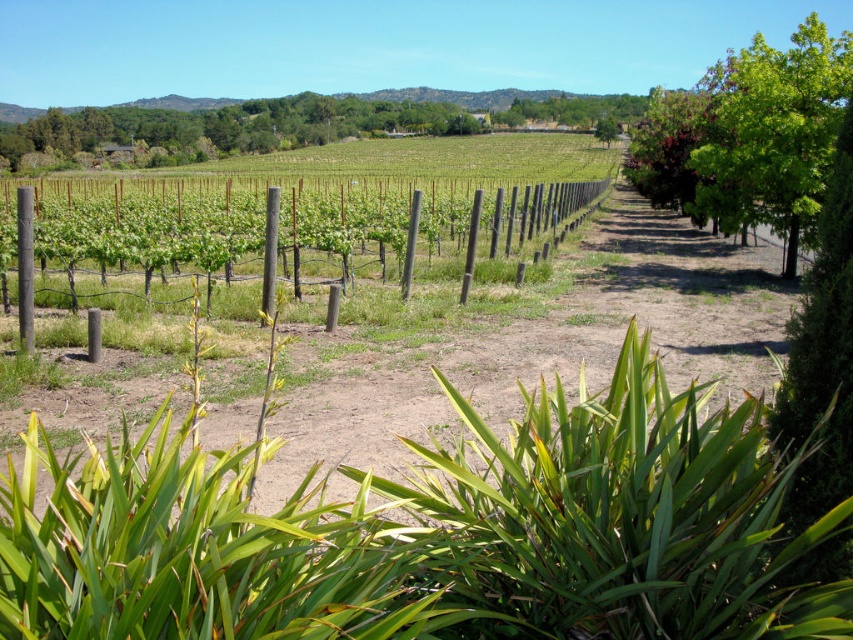
From the picture: Is green leafy tree at right shorter than green leafy tree at upper center?

No.

Can you confirm if green leafy tree at right is positioned above green leafy tree at upper center?

Actually, green leafy tree at right is below green leafy tree at upper center.

Locate an element on the screen. This screenshot has width=853, height=640. green leafy tree at right is located at coordinates (750, 134).

Is point (769, 45) positioned behind point (605, 138)?

No, (769, 45) is closer to viewer.

Between green leafy tree at right and green leafy tree at center-right, which one has less height?

With less height is green leafy tree at center-right.

Between point (633, 145) and point (614, 125), which one is positioned in front?

Positioned in front is point (633, 145).

The image size is (853, 640). I want to click on green leafy tree at right, so click(x=750, y=134).

In the scene shown: Does green leafy tree at upper center appear on the left side of green leafy tree at center-right?

Indeed, green leafy tree at upper center is positioned on the left side of green leafy tree at center-right.

Who is more distant from viewer, (451, 112) or (618, 129)?

Positioned behind is point (451, 112).

Locate an element on the screen. This screenshot has width=853, height=640. green leafy tree at upper center is located at coordinates 231,124.